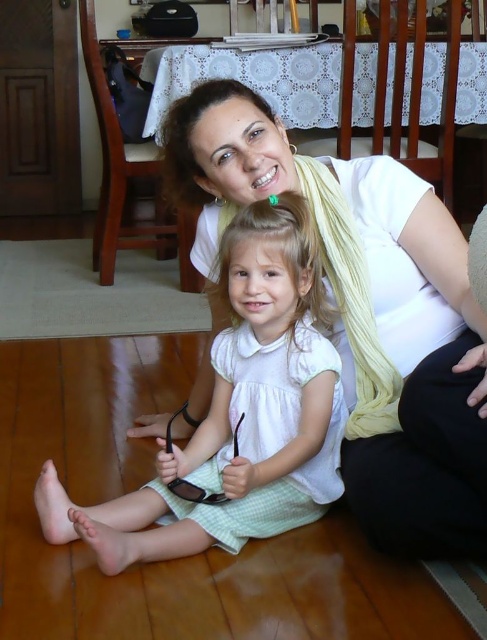
You are a photographer trying to capture a candid shot of the scene. You want to ensure both the white matte scarf at upper center and the white cotton dress at center are visible in your frame. Based on their positions, which object should you focus on first to include both in the shot?

The white matte scarf at upper center is to the right of the white cotton dress at center, so focusing on the white cotton dress at center first will allow you to adjust the frame to include both objects since the scarf is positioned to the right of the dress.

You are a photographer setting up a shoot in the scene. You need to place a small reflector to bounce light onto the white cotton dress at center without casting a shadow on the white matte scarf at upper center. Where should you position the reflector?

Place the reflector below the white cotton dress at center, ensuring it is positioned lower than the white matte scarf at upper center so the light reflects upward towards the dress without reaching the scarf.

You are an interior designer observing this scene. You need to place a small decorative item between the white matte scarf at upper center and the white cotton dress at center. Which object should the item be placed closer to?

The small decorative item should be placed closer to the white cotton dress at center because the white matte scarf at upper center is taller than the white cotton dress at center, meaning the dress is lower in position.